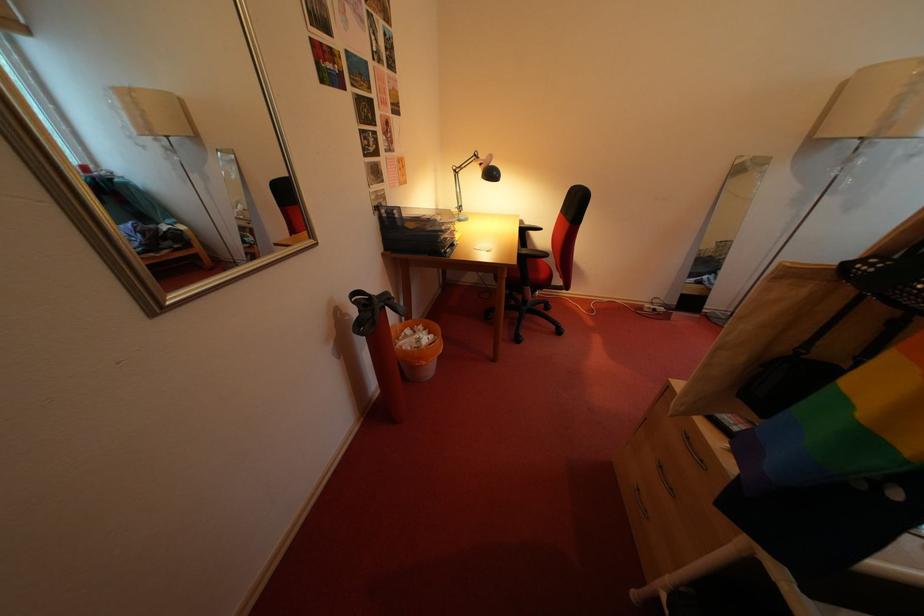
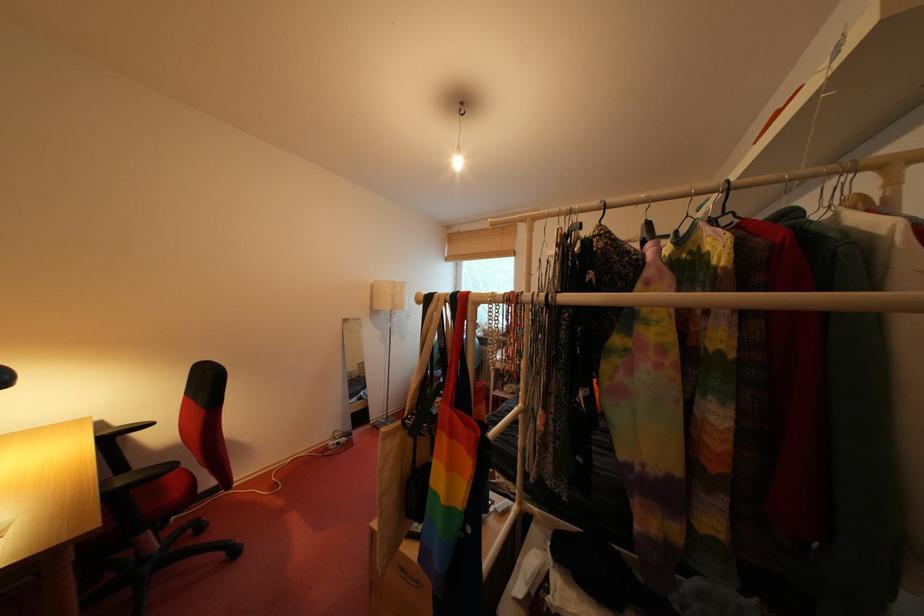
Locate, in the second image, the point that corresponds to [540,228] in the first image.

(131, 426)